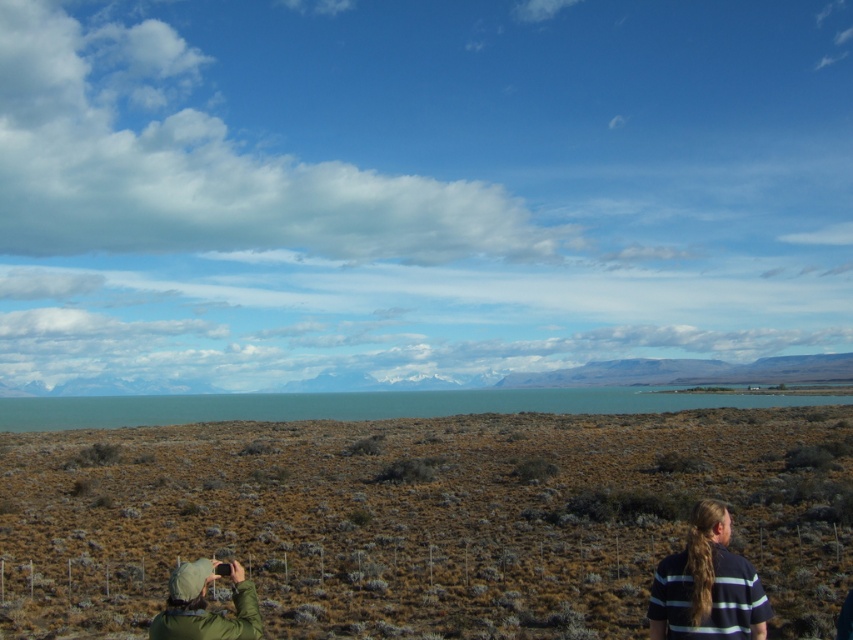
Question: Estimate the real-world distances between objects in this image. Which object is closer to the green fabric hat at lower left?

Choices:
 (A) brown dry grassland at center
 (B) teal glossy water at center
 (C) dark blue striped shirt at lower right

Answer: (C)

Question: Is teal glossy water at center in front of dark blue striped shirt at lower right?

Choices:
 (A) no
 (B) yes

Answer: (A)

Question: Which object appears farthest from the camera in this image?

Choices:
 (A) green fabric hat at lower left
 (B) dark blue striped shirt at lower right
 (C) teal glossy water at center

Answer: (C)

Question: Which point is closer to the camera?

Choices:
 (A) brown dry grassland at center
 (B) teal glossy water at center
 (C) green fabric hat at lower left

Answer: (C)

Question: Is teal glossy water at center wider than dark blue striped shirt at lower right?

Choices:
 (A) no
 (B) yes

Answer: (B)

Question: Does brown dry grassland at center lie behind green fabric hat at lower left?

Choices:
 (A) yes
 (B) no

Answer: (A)